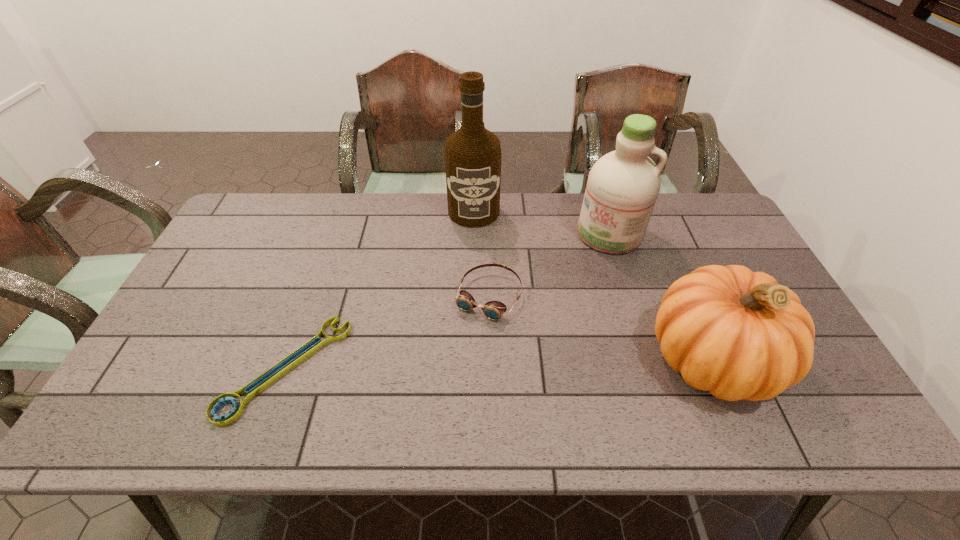
I want to click on pumpkin that is at the near edge, so click(738, 334).

Locate an element on the screen. object that is at the right edge is located at coordinates (738, 334).

You are a GUI agent. You are given a task and a screenshot of the screen. Output one action in this format:
    pyautogui.click(x=<x>, y=<y>)
    Task: Click on the object present at the near right corner
    This screenshot has height=540, width=960.
    Given the screenshot: What is the action you would take?
    pyautogui.click(x=738, y=334)

This screenshot has height=540, width=960. I want to click on vacant space at the far edge of the desktop, so click(x=376, y=200).

Where is `vacant space at the near edge of the desktop`? This screenshot has width=960, height=540. vacant space at the near edge of the desktop is located at coordinates (329, 375).

Locate an element on the screen. The image size is (960, 540). vacant area at the left edge is located at coordinates (203, 296).

The width and height of the screenshot is (960, 540). What are the coordinates of `vacant area at the right edge` in the screenshot? It's located at (718, 245).

At what (x,y) coordinates should I click in order to perform the action: click on vacant space at the far right corner of the desktop. Please return your answer as a coordinate pair (x, y). The height and width of the screenshot is (540, 960). Looking at the image, I should click on (689, 207).

Find the location of `vacant space in between the shortest object and the pumpkin`. vacant space in between the shortest object and the pumpkin is located at coordinates (498, 363).

Where is `free space between the goggles and the alcohol`? The width and height of the screenshot is (960, 540). free space between the goggles and the alcohol is located at coordinates pyautogui.click(x=481, y=254).